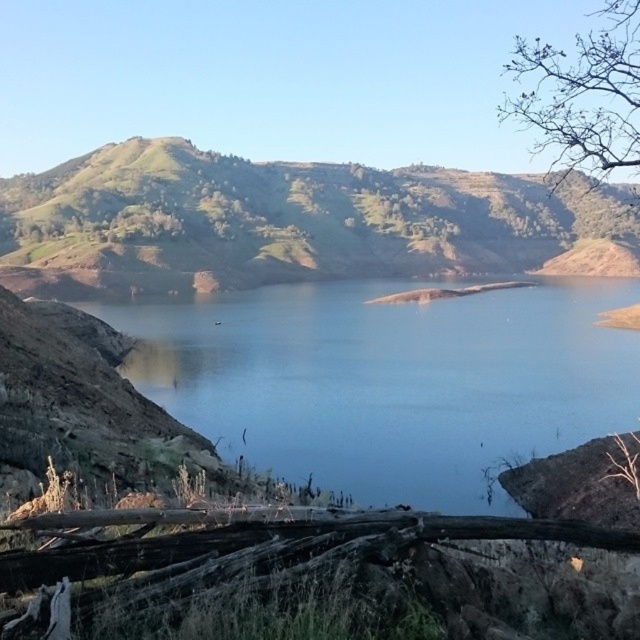
Does blue water at center have a larger size compared to green grassy hill at center?

No, blue water at center is not bigger than green grassy hill at center.

Does blue water at center appear under green grassy hill at center?

Indeed, blue water at center is positioned under green grassy hill at center.

What do you see at coordinates (388, 380) in the screenshot? I see `blue water at center` at bounding box center [388, 380].

Locate an element on the screen. Image resolution: width=640 pixels, height=640 pixels. blue water at center is located at coordinates (388, 380).

Between green grassy hill at center and bare branches at upper right, which one appears on the right side from the viewer's perspective?

bare branches at upper right is more to the right.

Who is more distant from viewer, (x=440, y=192) or (x=616, y=132)?

Positioned behind is point (x=616, y=132).

Is point (356, 188) in front of point (552, 64)?

That is True.

At what (x,y) coordinates should I click in order to perform the action: click on green grassy hill at center. Please return your answer as a coordinate pair (x, y). The image size is (640, 640). Looking at the image, I should click on (292, 221).

What are the coordinates of `blue water at center` in the screenshot? It's located at (388, 380).

Which is behind, point (355, 314) or point (632, 13)?

The point (632, 13) is behind.

You are a GUI agent. You are given a task and a screenshot of the screen. Output one action in this format:
    pyautogui.click(x=<x>, y=<y>)
    Task: Click on the blue water at center
    Image resolution: width=640 pixels, height=640 pixels.
    Given the screenshot: What is the action you would take?
    coord(388,380)